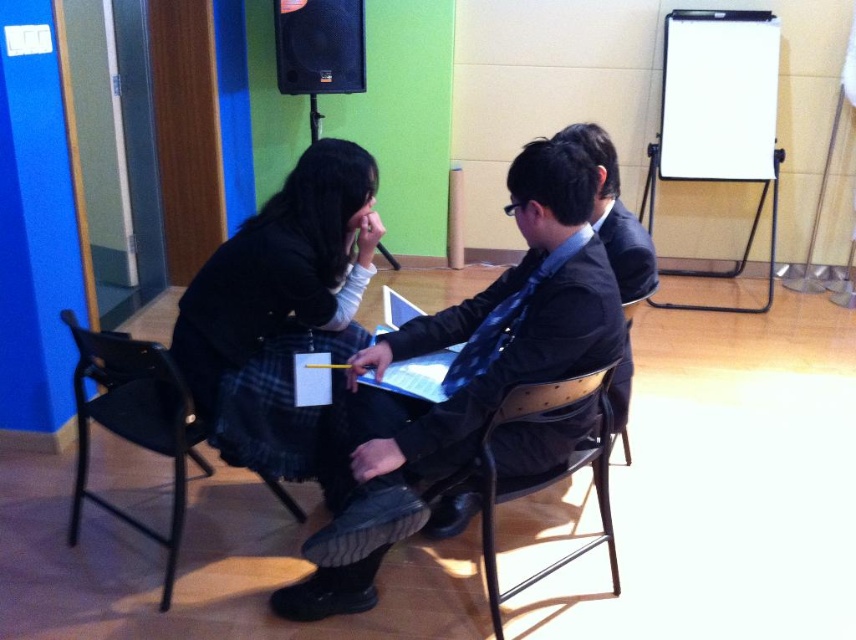
You are organizing a small event and need to place a 1.2 meter long table between the black plastic chair at lower left and the black plastic speaker at upper center. Based on their sizes, will the table fit between them?

The black plastic chair at lower left is larger in size than the black plastic speaker at upper center. Since the table is 1.2 meters long, it depends on the actual distance between them. However, the size comparison alone doesn not provide enough information to determine if the table will fit. You should measure the space between them first.

You are organizing a photo shoot and need to ensure that all participants are visible in the frame. Given that the plaid skirt at center and the black matte business suit at center are both central to the composition, which of these two items would you adjust to optimize the framing?

The plaid skirt at center is larger in size than the black matte business suit at center. To optimize framing, you might consider adjusting the position or angle of the plaid skirt at center since its larger size may require more space to ensure it is fully visible without overcrowding the frame.

You are standing at point (290, 67) and want to walk to point (128, 353). Is the point you want to reach in front of or behind you?

Point (128, 353) is in front of point (290, 67), so the point you want to reach is in front of you.